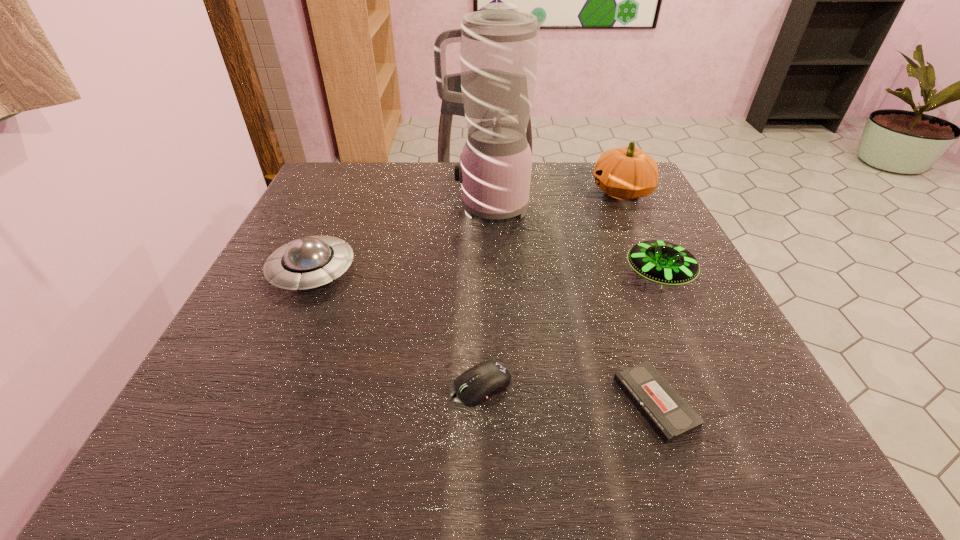
The width and height of the screenshot is (960, 540). Identify the location of free space at the far left corner of the desktop. (338, 162).

At what (x,y) coordinates should I click in order to perform the action: click on vacant space at the near right corner of the desktop. Please return your answer as a coordinate pair (x, y). The height and width of the screenshot is (540, 960). Looking at the image, I should click on (722, 429).

What are the coordinates of `free point between the gourd and the fifth tallest object` in the screenshot? It's located at (552, 288).

This screenshot has height=540, width=960. In order to click on free space between the right saucer and the computer equipment in this screenshot , I will do `click(570, 330)`.

Where is `unoccupied area between the computer equipment and the gourd`? The image size is (960, 540). unoccupied area between the computer equipment and the gourd is located at coordinates (552, 288).

Where is `free space that is in between the left saucer and the food processor`? This screenshot has height=540, width=960. free space that is in between the left saucer and the food processor is located at coordinates (399, 239).

You are a GUI agent. You are given a task and a screenshot of the screen. Output one action in this format:
    pyautogui.click(x=<x>, y=<y>)
    Task: Click on the vacant space that is in between the tallest object and the computer equipment
    The height and width of the screenshot is (540, 960).
    Given the screenshot: What is the action you would take?
    pyautogui.click(x=484, y=296)

The width and height of the screenshot is (960, 540). In order to click on empty space that is in between the right saucer and the tallest object in this screenshot , I will do `click(572, 241)`.

This screenshot has height=540, width=960. I want to click on free point between the fifth tallest object and the videotape, so click(x=568, y=394).

Locate an element on the screen. The image size is (960, 540). unoccupied position between the leftmost object and the food processor is located at coordinates (399, 239).